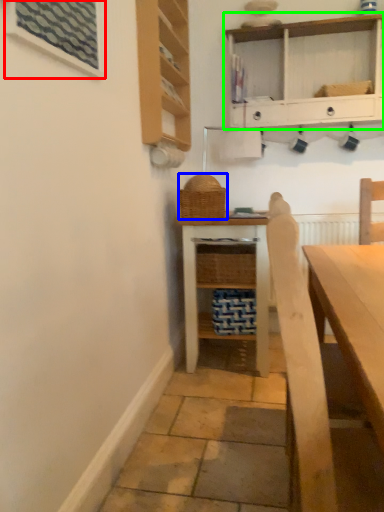
Question: Which object is positioned closest to window (highlighted by a red box)? Select from basket (highlighted by a blue box) and shelf (highlighted by a green box).

Choices:
 (A) basket
 (B) shelf

Answer: (A)